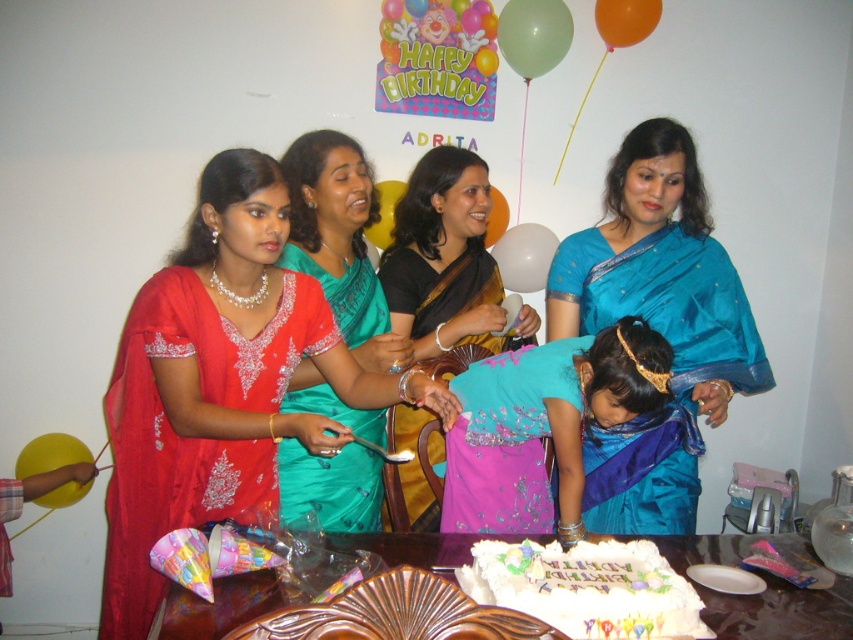
Question: Does matte red saree at center have a smaller size compared to white frosted cake at center?

Choices:
 (A) yes
 (B) no

Answer: (B)

Question: Is turquoise satin dress at center positioned at the back of white glossy cake at center?

Choices:
 (A) no
 (B) yes

Answer: (B)

Question: Is matte blue cake at center behind blue silk saree at center?

Choices:
 (A) yes
 (B) no

Answer: (A)

Question: Considering the real-world distances, which object is farthest from the black satin saree at center?

Choices:
 (A) white frosted cake at center
 (B) white glossy cake at center
 (C) matte blue cake at center
 (D) green silk saree at center

Answer: (A)

Question: Which of these objects is positioned farthest from the turquoise satin dress at center?

Choices:
 (A) green silk saree at center
 (B) matte blue cake at center

Answer: (A)

Question: Which of these objects is positioned farthest from the black satin saree at center?

Choices:
 (A) green silk saree at center
 (B) matte red saree at center
 (C) white frosted cake at center

Answer: (C)